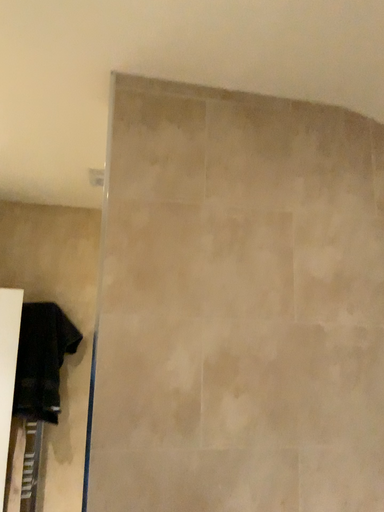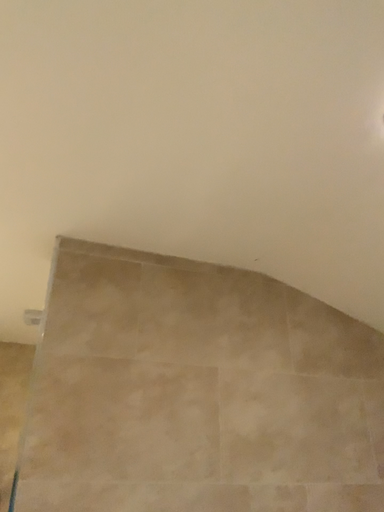
Question: How did the camera likely rotate when shooting the video?

Choices:
 (A) rotated downward
 (B) rotated upward

Answer: (B)